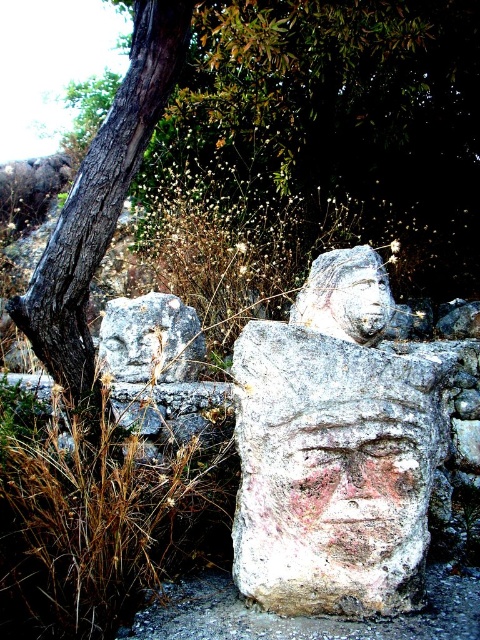
You are standing in front of the ancient stone sculptures and want to touch the two points mentioned. Which point, point [408,474] or point [347,285], will require you to reach further out?

Point [347,285] will require you to reach further out because it is farther from the viewer compared to point [408,474].

You are standing at the base of the large stone head with a painted face in the foreground. You notice two points marked in the scene. The first point is at coordinates point (29, 589) and the second point is at point (333, 275). Which of these two points is closer to your current position?

Point (29, 589) is closer to your current position because it is in front of point (333, 275).

You are an archaeologist examining the stone sculptures. You notice two objects in the scene described as the white stone carving at center and the smooth stone face at center. Which of these two objects is taller?

The white stone carving at center is taller than the smooth stone face at center.